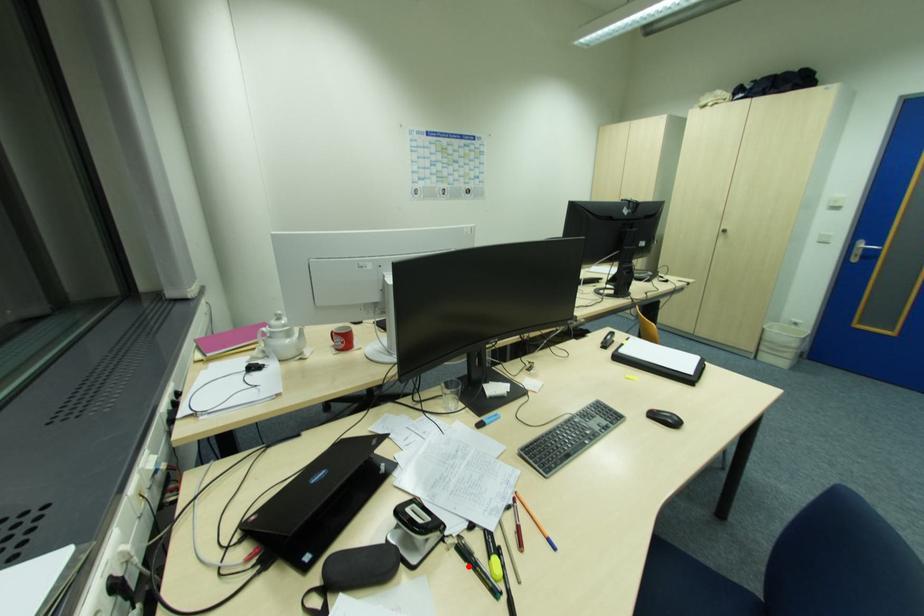
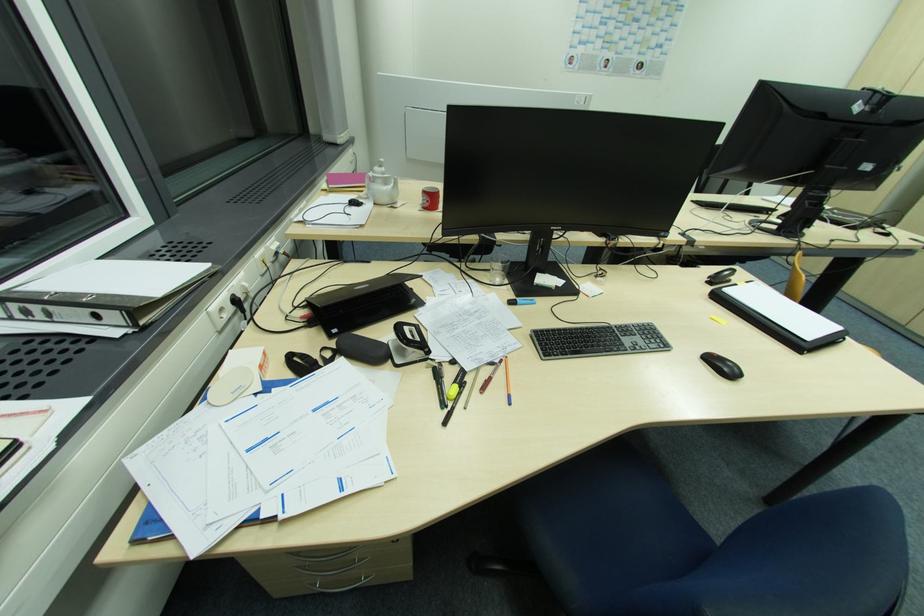
Locate, in the second image, the point that corresponds to the highlighted location in the first image.

(436, 383)